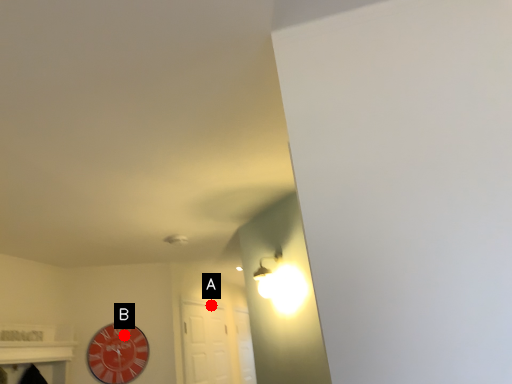
Question: Two points are circled on the image, labeled by A and B beside each circle. Among these points, which one is farthest from the camera?

Choices:
 (A) A is further
 (B) B is further

Answer: (A)